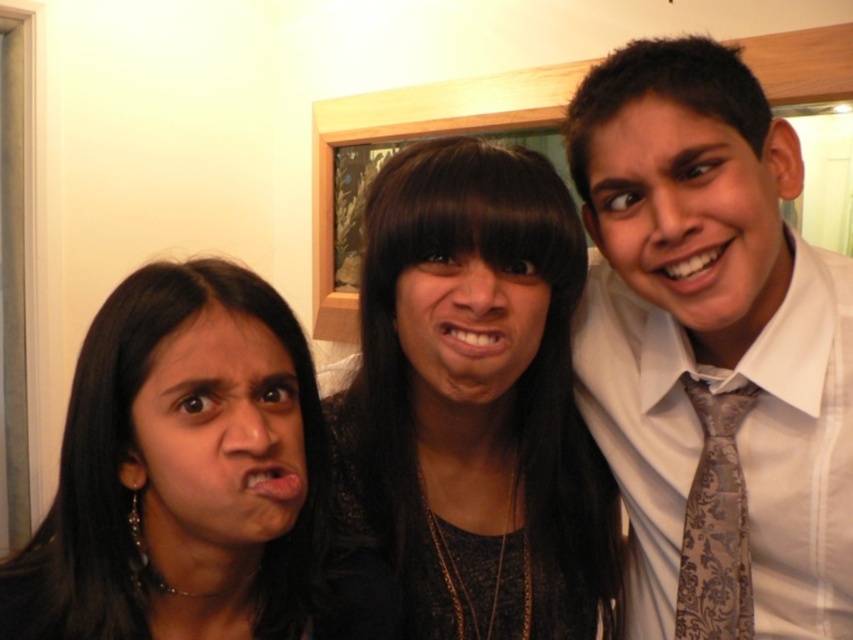
Measure the distance between white silk shirt at right and dark brown hair at center.

They are 41.89 centimeters apart.

Where is `white silk shirt at right`? The width and height of the screenshot is (853, 640). white silk shirt at right is located at coordinates (712, 342).

What are the coordinates of `white silk shirt at right` in the screenshot? It's located at (712, 342).

Locate an element on the screen. This screenshot has height=640, width=853. white silk shirt at right is located at coordinates (x=712, y=342).

Does point (131, 300) come closer to viewer compared to point (688, 515)?

Yes.

Where is `dark brown hair at center`? dark brown hair at center is located at coordinates (x=193, y=480).

Does black lace dress at center appear under dark brown hair at center?

Incorrect, black lace dress at center is not positioned below dark brown hair at center.

Does black lace dress at center have a greater width compared to dark brown hair at center?

Yes.

Who is more distant from viewer, (534, 160) or (189, 556)?

Point (534, 160)

This screenshot has height=640, width=853. In order to click on black lace dress at center in this screenshot , I will do `click(476, 401)`.